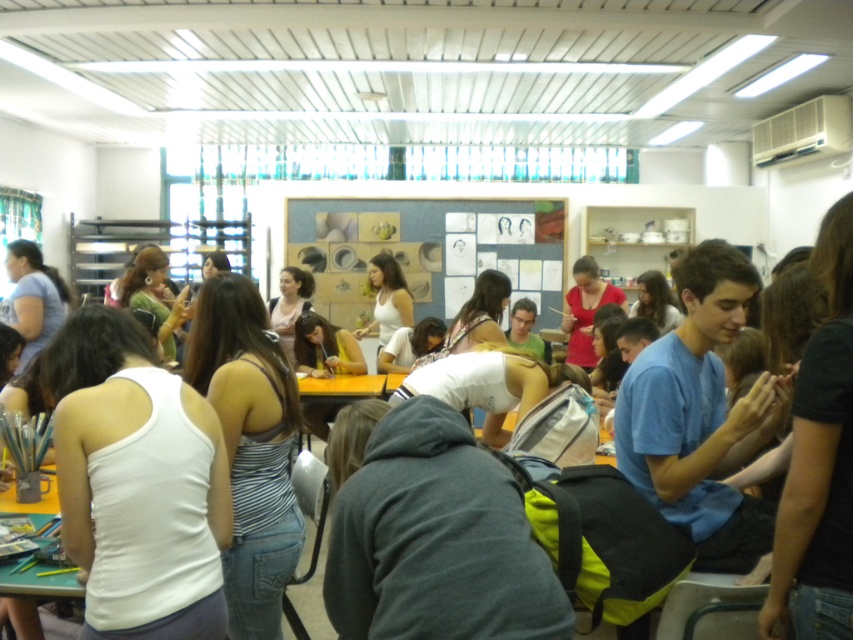
Question: Does white matte tank top at lower left lie in front of striped fabric tank top at center?

Choices:
 (A) no
 (B) yes

Answer: (B)

Question: Does white matte tank top at lower left appear over striped fabric tank top at center?

Choices:
 (A) yes
 (B) no

Answer: (A)

Question: Which object is farther from the camera taking this photo?

Choices:
 (A) striped fabric tank top at center
 (B) white matte tank top at lower left

Answer: (A)

Question: Does white matte tank top at lower left have a lesser width compared to striped fabric tank top at center?

Choices:
 (A) yes
 (B) no

Answer: (B)